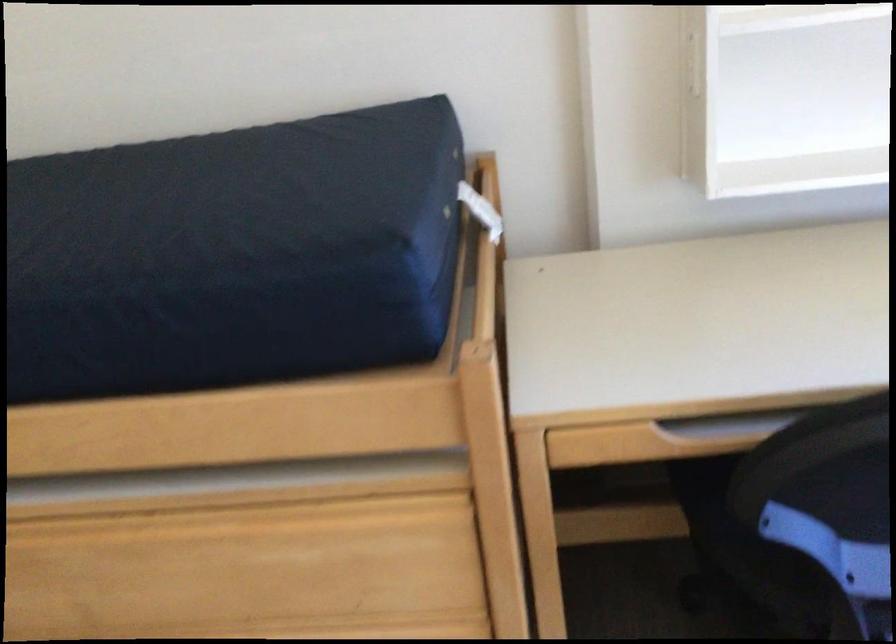
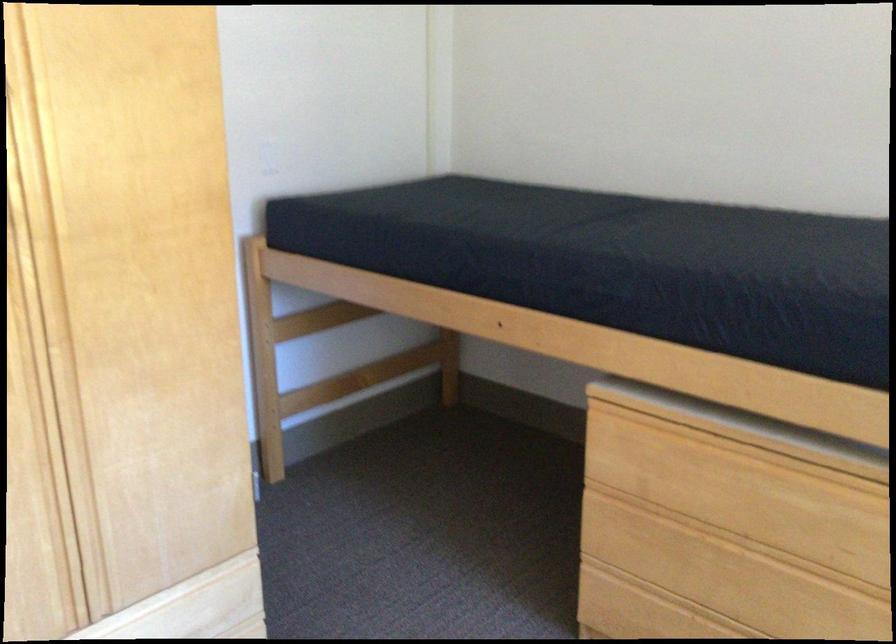
In the second image, find the point that corresponds to point (202, 567) in the first image.

(728, 488)